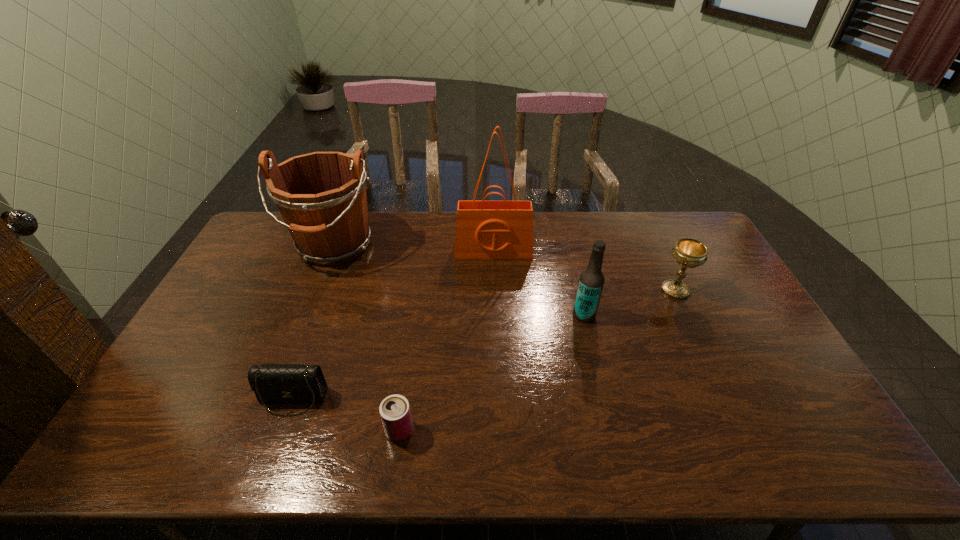
Locate an element on the screen. Image resolution: width=960 pixels, height=540 pixels. object positioned at the near edge is located at coordinates (395, 413).

What are the coordinates of `object situated at the left edge` in the screenshot? It's located at (321, 196).

What are the coordinates of `object present at the right edge` in the screenshot? It's located at (689, 253).

Locate an element on the screen. object present at the far left corner is located at coordinates (321, 196).

Where is `free space at the far edge`? The image size is (960, 540). free space at the far edge is located at coordinates (397, 213).

Locate an element on the screen. The image size is (960, 540). vacant space at the near edge of the desktop is located at coordinates (767, 453).

At what (x,y) coordinates should I click in order to perform the action: click on blank space at the left edge. Please return your answer as a coordinate pair (x, y). This screenshot has height=540, width=960. Looking at the image, I should click on (255, 296).

The height and width of the screenshot is (540, 960). I want to click on vacant space at the right edge of the desktop, so click(x=685, y=280).

In the image, there is a desktop. Where is `free space at the near right corner`? The height and width of the screenshot is (540, 960). free space at the near right corner is located at coordinates (783, 438).

In order to click on free area in between the bucket and the fifth object from left to right in this screenshot , I will do `click(459, 280)`.